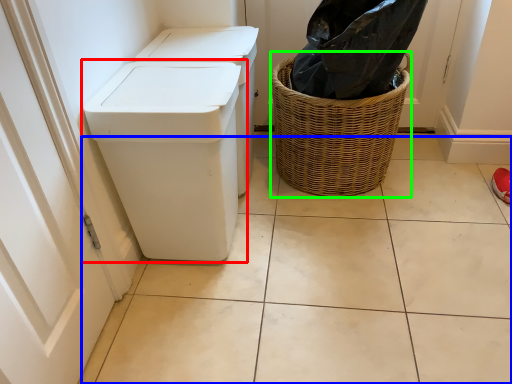
Question: Which object is positioned farthest from waste container (highlighted by a red box)? Select from tile (highlighted by a blue box) and basket (highlighted by a green box).

Choices:
 (A) tile
 (B) basket

Answer: (B)